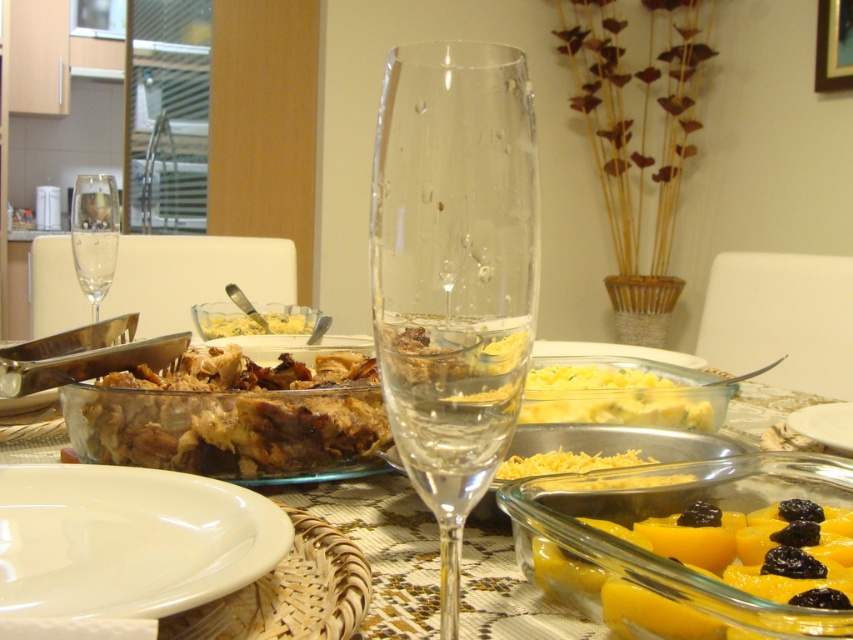
Between clear glass wine glass at center and yellow gelatinous cubes at center, which one has less height?

yellow gelatinous cubes at center

Between clear glass wine glass at center and yellow gelatinous cubes at center, which one appears on the left side from the viewer's perspective?

yellow gelatinous cubes at center is more to the left.

Image resolution: width=853 pixels, height=640 pixels. Describe the element at coordinates (381, 545) in the screenshot. I see `clear glass wine glass at center` at that location.

Find the location of a particular element. This screenshot has height=640, width=853. clear glass wine glass at center is located at coordinates (381, 545).

Between point (395, 182) and point (825, 566), which one is positioned behind?

Positioned behind is point (825, 566).

Which of these two, transparent glass at center or yellow gelatinous cubes at center, stands taller?

transparent glass at center

The width and height of the screenshot is (853, 640). What do you see at coordinates (453, 272) in the screenshot?
I see `transparent glass at center` at bounding box center [453, 272].

Locate an element on the screen. The image size is (853, 640). transparent glass at center is located at coordinates (453, 272).

Which is in front, point (137, 552) or point (86, 260)?

Point (137, 552) is in front.

Who is positioned more to the left, white ceramic plate at lower left or clear glass wine glass at left?

Positioned to the left is clear glass wine glass at left.

The image size is (853, 640). What are the coordinates of `white ceramic plate at lower left` in the screenshot? It's located at (128, 540).